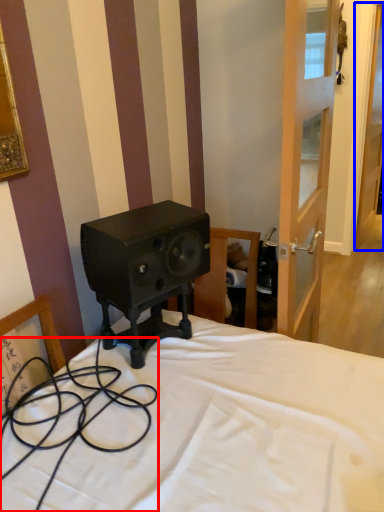
Question: Which of the following is the farthest to the observer, cable (highlighted by a red box) or door (highlighted by a blue box)?

Choices:
 (A) cable
 (B) door

Answer: (B)